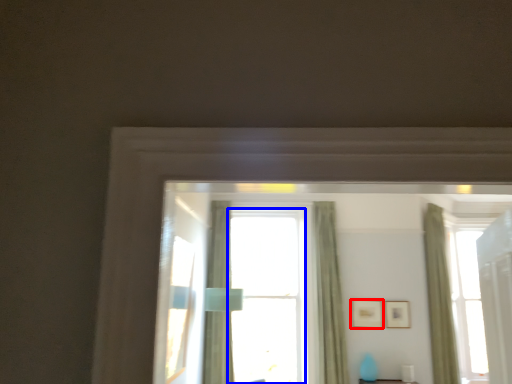
Question: Which object is closer to the camera taking this photo, picture frame (highlighted by a red box) or window (highlighted by a blue box)?

Choices:
 (A) picture frame
 (B) window

Answer: (B)